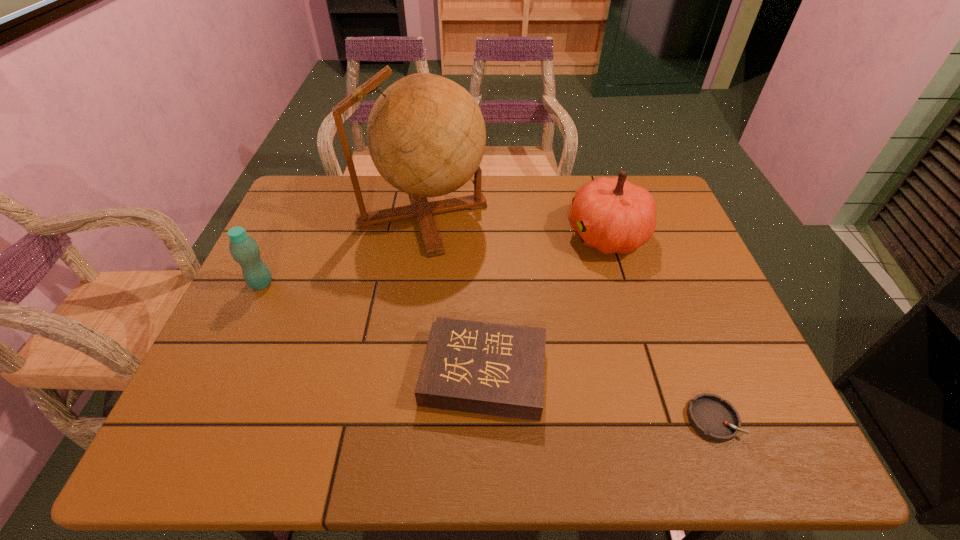
Where is `object present at the far right corner`? This screenshot has width=960, height=540. object present at the far right corner is located at coordinates (612, 215).

Locate an element on the screen. This screenshot has width=960, height=540. object positioned at the near right corner is located at coordinates (713, 418).

In the image, there is a desktop. Identify the location of vacant space at the far edge. The height and width of the screenshot is (540, 960). (519, 198).

This screenshot has height=540, width=960. Find the location of `free region at the near edge of the desktop`. free region at the near edge of the desktop is located at coordinates (511, 423).

In the image, there is a desktop. Where is `vacant space at the left edge`? This screenshot has width=960, height=540. vacant space at the left edge is located at coordinates click(235, 339).

Locate an element on the screen. The height and width of the screenshot is (540, 960). vacant space at the far left corner of the desktop is located at coordinates (325, 213).

Where is `free space at the near left corner of the desktop`? This screenshot has height=540, width=960. free space at the near left corner of the desktop is located at coordinates (207, 453).

The image size is (960, 540). In the image, there is a desktop. In order to click on vacant area at the near right corner in this screenshot , I will do `click(775, 416)`.

What are the coordinates of `vacant space that's between the third tallest object and the pumpkin` in the screenshot? It's located at (434, 259).

The image size is (960, 540). Find the location of `vacant point located between the water bottle and the fourth tallest object`. vacant point located between the water bottle and the fourth tallest object is located at coordinates click(x=372, y=328).